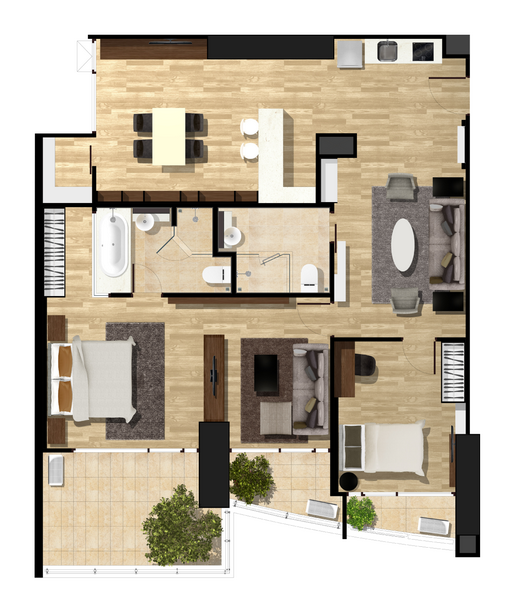
Locate an element on the screen. The width and height of the screenshot is (515, 596). chair is located at coordinates [x=188, y=149].